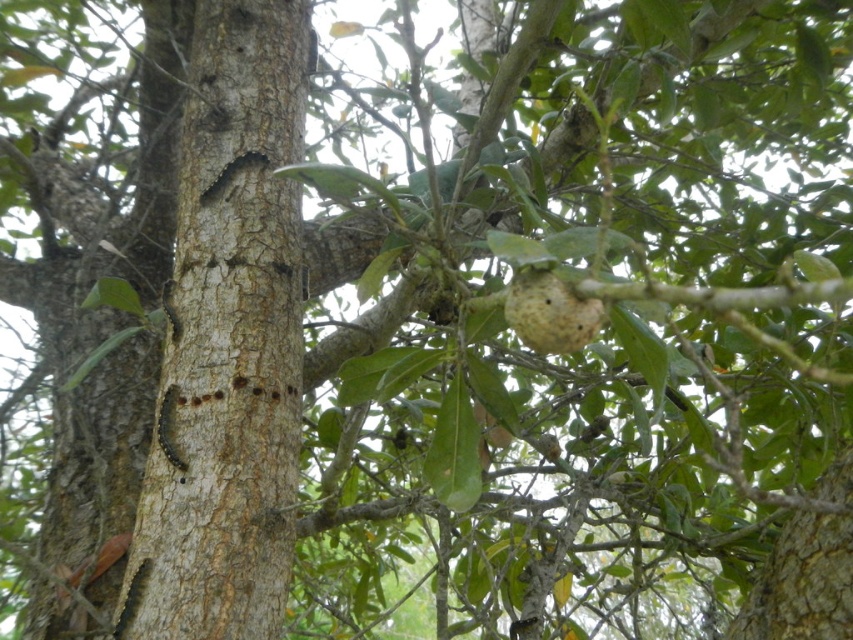
Question: Among these objects, which one is nearest to the camera?

Choices:
 (A) yellow matte fruit at center
 (B) rough bark tree trunk at center

Answer: (A)

Question: Is rough bark tree trunk at center positioned behind yellow matte fruit at center?

Choices:
 (A) no
 (B) yes

Answer: (B)

Question: Can you confirm if rough bark tree trunk at center is positioned above yellow matte fruit at center?

Choices:
 (A) no
 (B) yes

Answer: (B)

Question: Is rough bark tree trunk at center to the left of yellow matte fruit at center from the viewer's perspective?

Choices:
 (A) yes
 (B) no

Answer: (A)

Question: Which point is closer to the camera?

Choices:
 (A) rough bark tree trunk at center
 (B) yellow matte fruit at center

Answer: (B)